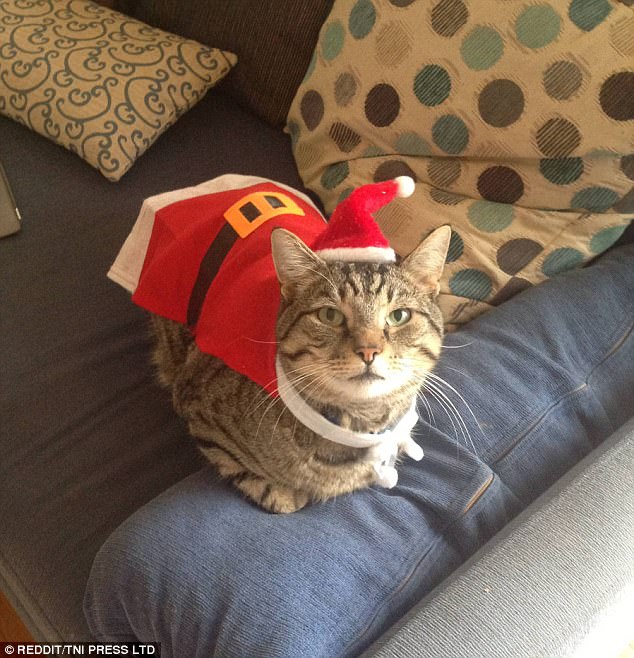
I want to click on blue jean material couch arm, so click(287, 559).